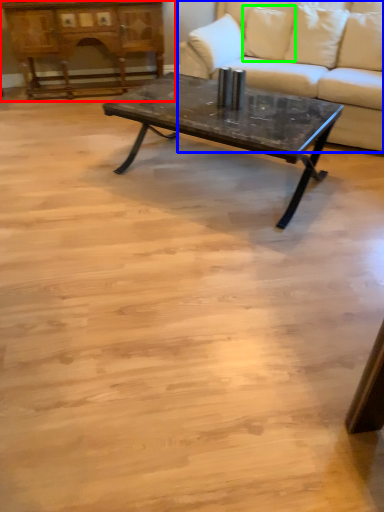
Question: Which object is positioned farthest from dresser (highlighted by a red box)? Select from studio couch (highlighted by a blue box) and pillow (highlighted by a green box).

Choices:
 (A) studio couch
 (B) pillow

Answer: (B)